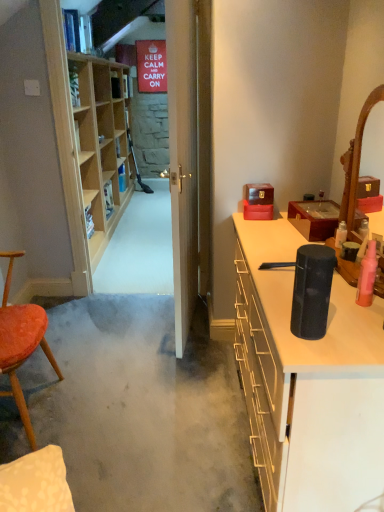
This screenshot has height=512, width=384. Identify the location of free point in front of pink matte bottle at right. (359, 327).